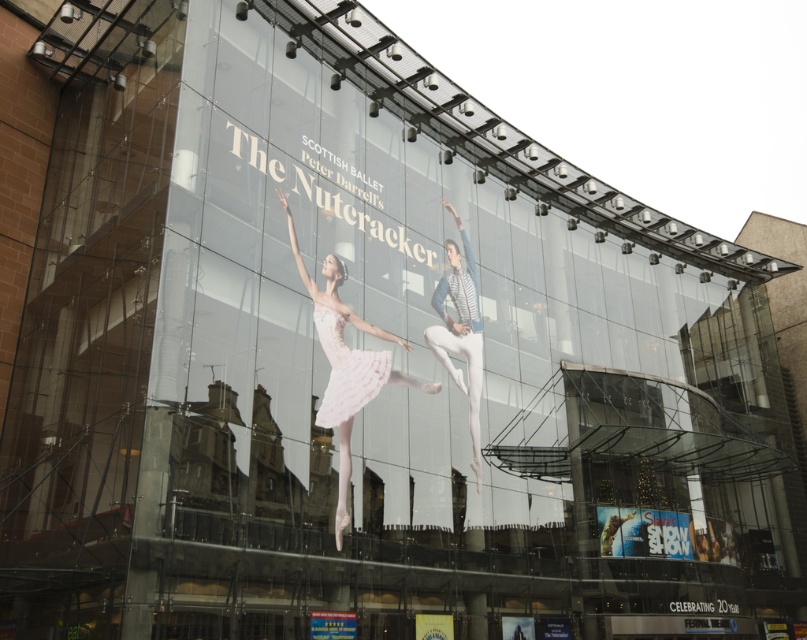
Is light pink satin tutu at center above white tulle skirt at center?

No.

Which is above, light pink satin tutu at center or white tulle skirt at center?

white tulle skirt at center is above.

Image resolution: width=807 pixels, height=640 pixels. Describe the element at coordinates (346, 364) in the screenshot. I see `light pink satin tutu at center` at that location.

I want to click on light pink satin tutu at center, so click(x=346, y=364).

Is point (356, 401) closer to camera compared to point (461, 282)?

Yes, it is.

The image size is (807, 640). Describe the element at coordinates (346, 364) in the screenshot. I see `light pink satin tutu at center` at that location.

Which is in front, point (327, 259) or point (435, 292)?

Point (327, 259) is in front.

Identify the location of light pink satin tutu at center. The image size is (807, 640). 346,364.

How much distance is there between white matte ballet dancer at center and white tulle skirt at center?

white matte ballet dancer at center and white tulle skirt at center are 13.38 meters apart from each other.

Which is in front, point (458, 348) or point (323, 308)?

Point (323, 308) is more forward.

I want to click on white matte ballet dancer at center, so click(460, 332).

Where is `white matte ballet dancer at center`? white matte ballet dancer at center is located at coordinates click(460, 332).